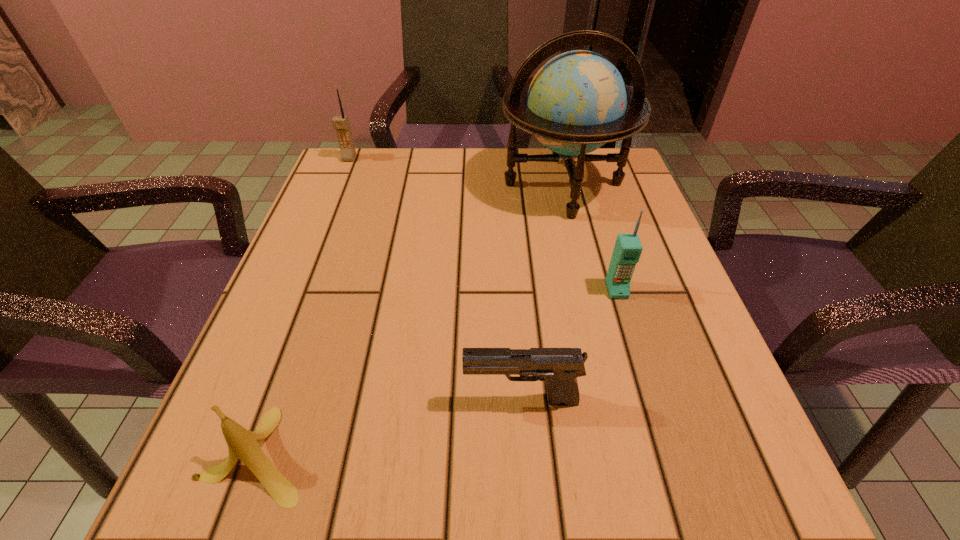
Locate an element on the screen. The height and width of the screenshot is (540, 960). object that is the second closest to the pistol is located at coordinates (627, 250).

You are a GUI agent. You are given a task and a screenshot of the screen. Output one action in this format:
    pyautogui.click(x=<x>, y=<y>)
    Task: Click on the third closest object to the pistol
    The image size is (960, 540).
    Given the screenshot: What is the action you would take?
    pyautogui.click(x=577, y=102)

Identify the location of free location that satisfies the following two spatial constraints: 1. on the surface of the globe; 2. aim along the barrel of the pistol. (614, 401).

I want to click on free location that satisfies the following two spatial constraints: 1. on the keypad of the third nearest object; 2. aim along the barrel of the pistol, so click(x=650, y=401).

You are a GUI agent. You are given a task and a screenshot of the screen. Output one action in this format:
    pyautogui.click(x=<x>, y=<y>)
    Task: Click on the vacant point that satisfies the following two spatial constraints: 1. on the keypad of the third nearest object; 2. aim along the barrel of the pistol
    The width and height of the screenshot is (960, 540).
    Given the screenshot: What is the action you would take?
    650,401

This screenshot has width=960, height=540. I want to click on vacant area that satisfies the following two spatial constraints: 1. on the front of the left cellular telephone, where the keypad is located; 2. on the left side of the banana, so tap(229, 454).